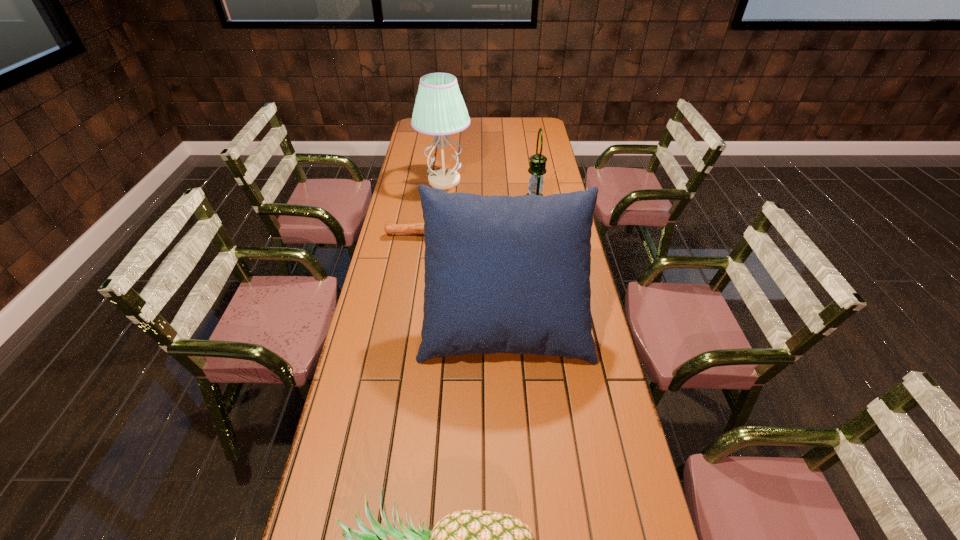
The image size is (960, 540). In order to click on object that is the second closest to the second nearest object in this screenshot , I will do `click(466, 539)`.

You are a GUI agent. You are given a task and a screenshot of the screen. Output one action in this format:
    pyautogui.click(x=<x>, y=<y>)
    Task: Click on the object that ranks as the third closest to the lantern
    This screenshot has height=540, width=960.
    Given the screenshot: What is the action you would take?
    tap(503, 274)